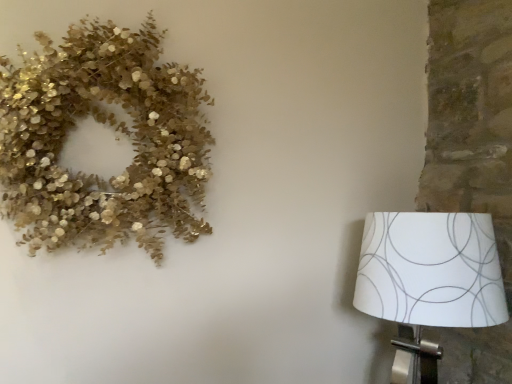
What do you see at coordinates (114, 129) in the screenshot? This screenshot has width=512, height=384. I see `gold glittery wreath at upper left` at bounding box center [114, 129].

This screenshot has width=512, height=384. I want to click on gold glittery wreath at upper left, so click(x=114, y=129).

In the scene shown: What is the approximate width of white paper lampshade at right?

It is 17.94 inches.

Identify the location of white paper lampshade at right. Image resolution: width=512 pixels, height=384 pixels. (428, 282).

What do you see at coordinates (428, 282) in the screenshot? This screenshot has height=384, width=512. I see `white paper lampshade at right` at bounding box center [428, 282].

Where is `gold glittery wreath at upper left`? The width and height of the screenshot is (512, 384). gold glittery wreath at upper left is located at coordinates (114, 129).

Is gold glittery wreath at upper left to the left of white paper lampshade at right from the viewer's perspective?

Yes.

Between gold glittery wreath at upper left and white paper lampshade at right, which one is positioned in front?

gold glittery wreath at upper left is in front.

Does point (194, 173) lie in front of point (474, 260)?

That is False.

From the image's perspective, does gold glittery wreath at upper left appear lower than white paper lampshade at right?

No, from the image's perspective, gold glittery wreath at upper left is not beneath white paper lampshade at right.

From a real-world perspective, which is physically above, gold glittery wreath at upper left or white paper lampshade at right?

gold glittery wreath at upper left, from a real-world perspective.

Can you confirm if gold glittery wreath at upper left is wider than white paper lampshade at right?

No, gold glittery wreath at upper left is not wider than white paper lampshade at right.

Consider the image. From their relative heights in the image, would you say gold glittery wreath at upper left is taller or shorter than white paper lampshade at right?

In the image, gold glittery wreath at upper left appears to be taller than white paper lampshade at right.

Can you confirm if gold glittery wreath at upper left is bigger than white paper lampshade at right?

Actually, gold glittery wreath at upper left might be smaller than white paper lampshade at right.

Is white paper lampshade at right surrounded by gold glittery wreath at upper left?

No, gold glittery wreath at upper left does not contain white paper lampshade at right.

Are gold glittery wreath at upper left and white paper lampshade at right beside each other?

No, gold glittery wreath at upper left is not making contact with white paper lampshade at right.

Is gold glittery wreath at upper left turned away from white paper lampshade at right?

No, white paper lampshade at right is not at the back of gold glittery wreath at upper left.

Can you tell me how much gold glittery wreath at upper left and white paper lampshade at right differ in facing direction?

The facing directions of gold glittery wreath at upper left and white paper lampshade at right are 0.465 degrees apart.

Identify the location of floral arrangement above the white paper lampshade at right (from a real-world perspective). (114, 129).

Considering the relative positions of white paper lampshade at right and gold glittery wreath at upper left in the image provided, is white paper lampshade at right to the left of gold glittery wreath at upper left from the viewer's perspective?

Incorrect, white paper lampshade at right is not on the left side of gold glittery wreath at upper left.

Is the depth of white paper lampshade at right greater than that of gold glittery wreath at upper left?

Yes, white paper lampshade at right is behind gold glittery wreath at upper left.

Which is less distant, [463,265] or [83,203]?

The point [463,265] is closer to the camera.

From the image's perspective, which is below, white paper lampshade at right or gold glittery wreath at upper left?

white paper lampshade at right appears lower in the image.

From a real-world perspective, which object stands above the other?

In real-world perspective, gold glittery wreath at upper left is above.

Looking at their sizes, would you say white paper lampshade at right is wider or thinner than gold glittery wreath at upper left?

white paper lampshade at right is wider than gold glittery wreath at upper left.

Which of these two, white paper lampshade at right or gold glittery wreath at upper left, stands shorter?

Standing shorter between the two is white paper lampshade at right.

Does white paper lampshade at right have a smaller size compared to gold glittery wreath at upper left?

Actually, white paper lampshade at right might be larger than gold glittery wreath at upper left.

Is gold glittery wreath at upper left located within white paper lampshade at right?

No, gold glittery wreath at upper left is not surrounded by white paper lampshade at right.

Is there a large distance between white paper lampshade at right and gold glittery wreath at upper left?

white paper lampshade at right is near gold glittery wreath at upper left, not far away.

Could you tell me if white paper lampshade at right is turned towards gold glittery wreath at upper left?

No, white paper lampshade at right is not turned towards gold glittery wreath at upper left.

What's the angular difference between white paper lampshade at right and gold glittery wreath at upper left's facing directions?

The angle between the facing direction of white paper lampshade at right and the facing direction of gold glittery wreath at upper left is 0.465 degrees.

Identify the location of floral arrangement that is on the left side of white paper lampshade at right. The image size is (512, 384). [114, 129].

The width and height of the screenshot is (512, 384). I want to click on lamp that is on the right side of gold glittery wreath at upper left, so click(x=428, y=282).

You are a GUI agent. You are given a task and a screenshot of the screen. Output one action in this format:
    pyautogui.click(x=<x>, y=<y>)
    Task: Click on the lamp below the gold glittery wreath at upper left (from a real-world perspective)
    
    Given the screenshot: What is the action you would take?
    pyautogui.click(x=428, y=282)